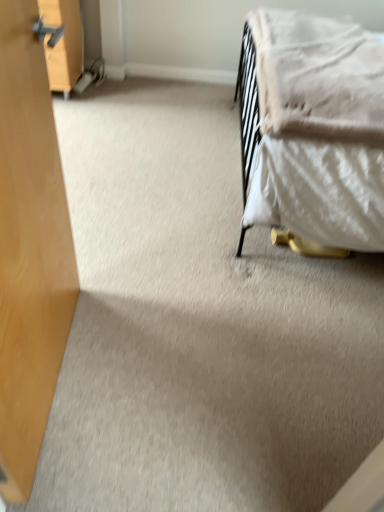
What is the approximate height of soft pink quilt at right?

soft pink quilt at right is 5.66 inches tall.

This screenshot has height=512, width=384. Identify the location of soft pink quilt at right. click(318, 76).

Describe the element at coordinates (318, 76) in the screenshot. Image resolution: width=384 pixels, height=512 pixels. I see `soft pink quilt at right` at that location.

In order to face soft pink quilt at right, should I rotate leftwards or rightwards?

Rotate right and turn 16.796 degrees.

Identify the location of wooden drawer at upper left. Image resolution: width=384 pixels, height=512 pixels. (63, 42).

This screenshot has width=384, height=512. Describe the element at coordinates (63, 42) in the screenshot. I see `wooden drawer at upper left` at that location.

You are a GUI agent. You are given a task and a screenshot of the screen. Output one action in this format:
    pyautogui.click(x=<x>, y=<y>)
    Task: Click on the soft pink quilt at right
    The height and width of the screenshot is (512, 384).
    Given the screenshot: What is the action you would take?
    pyautogui.click(x=318, y=76)

Would you say soft pink quilt at right is to the left or to the right of wooden drawer at upper left in the picture?

Clearly, soft pink quilt at right is on the right of wooden drawer at upper left in the image.

Is the position of soft pink quilt at right less distant than that of wooden drawer at upper left?

That is True.

Which is in front, point (340, 52) or point (56, 89)?

The point (340, 52) is closer.

From the image's perspective, is soft pink quilt at right over wooden drawer at upper left?

No, from the image's perspective, soft pink quilt at right is not above wooden drawer at upper left.

From a real-world perspective, is soft pink quilt at right on wooden drawer at upper left?

Yes, from a real-world perspective, soft pink quilt at right is on top of wooden drawer at upper left.

Between soft pink quilt at right and wooden drawer at upper left, which one has smaller width?

Thinner between the two is wooden drawer at upper left.

From their relative heights in the image, would you say soft pink quilt at right is taller or shorter than wooden drawer at upper left?

In the image, soft pink quilt at right appears to be shorter than wooden drawer at upper left.

Based on the photo, considering the relative sizes of soft pink quilt at right and wooden drawer at upper left in the image provided, is soft pink quilt at right smaller than wooden drawer at upper left?

Actually, soft pink quilt at right might be larger than wooden drawer at upper left.

Would you say soft pink quilt at right is inside or outside wooden drawer at upper left?

soft pink quilt at right is outside wooden drawer at upper left.

Is soft pink quilt at right positioned far away from wooden drawer at upper left?

Yes, soft pink quilt at right is far from wooden drawer at upper left.

Does soft pink quilt at right turn towards wooden drawer at upper left?

No, soft pink quilt at right is not aimed at wooden drawer at upper left.

How many degrees apart are the facing directions of soft pink quilt at right and wooden drawer at upper left?

The angular difference between soft pink quilt at right and wooden drawer at upper left is 90.7 degrees.

How distant is soft pink quilt at right from wooden drawer at upper left?

soft pink quilt at right and wooden drawer at upper left are 1.19 meters apart.

Identify the location of drawer below the soft pink quilt at right (from a real-world perspective). Image resolution: width=384 pixels, height=512 pixels. (63, 42).

Between wooden drawer at upper left and soft pink quilt at right, which one appears on the left side from the viewer's perspective?

From the viewer's perspective, wooden drawer at upper left appears more on the left side.

Which object is further away from the camera, wooden drawer at upper left or soft pink quilt at right?

Positioned behind is wooden drawer at upper left.

Considering the positions of points (71, 89) and (358, 137), is point (71, 89) farther from camera compared to point (358, 137)?

Yes.

From the image's perspective, is wooden drawer at upper left above soft pink quilt at right?

Correct, wooden drawer at upper left appears higher than soft pink quilt at right in the image.

From a real-world perspective, between wooden drawer at upper left and soft pink quilt at right, who is vertically higher?

In real-world perspective, soft pink quilt at right is above.

Looking at this image, is wooden drawer at upper left wider than soft pink quilt at right?

No.

Which of these two, wooden drawer at upper left or soft pink quilt at right, stands shorter?

soft pink quilt at right is shorter.

In terms of size, does wooden drawer at upper left appear bigger or smaller than soft pink quilt at right?

Clearly, wooden drawer at upper left is smaller in size than soft pink quilt at right.

Is soft pink quilt at right surrounded by wooden drawer at upper left?

Actually, soft pink quilt at right is outside wooden drawer at upper left.

Is the surface of wooden drawer at upper left in direct contact with soft pink quilt at right?

No.

In the scene shown: Is wooden drawer at upper left looking in the opposite direction of soft pink quilt at right?

That's not correct — wooden drawer at upper left is not looking away from soft pink quilt at right.

Find the location of a particular element. Image resolution: width=384 pixels, height=512 pixels. drawer behind the soft pink quilt at right is located at coordinates (63, 42).

Identify the location of drawer that is above the soft pink quilt at right (from the image's perspective). (63, 42).

Find the location of `blanket above the wooden drawer at upper left (from a real-world perspective)`. blanket above the wooden drawer at upper left (from a real-world perspective) is located at coordinates (318, 76).